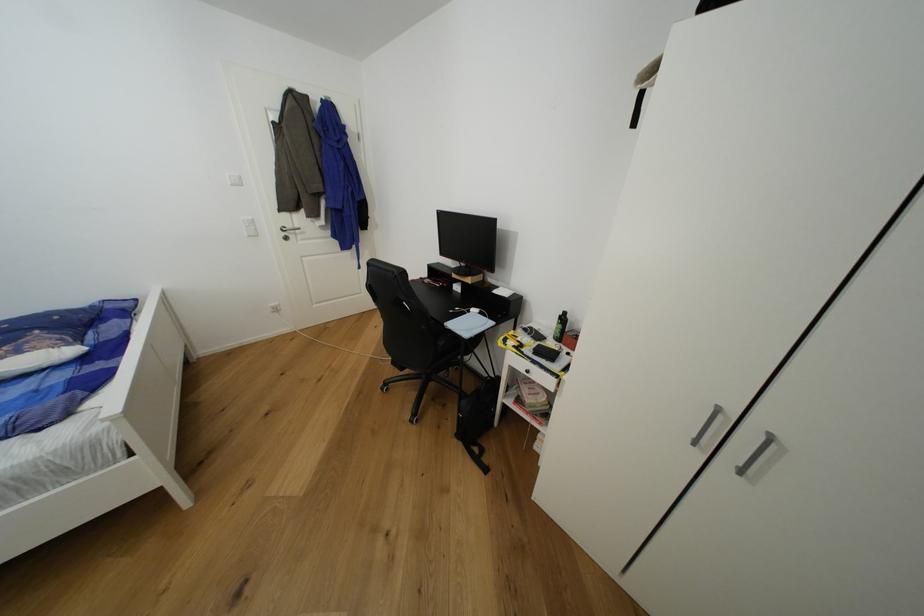
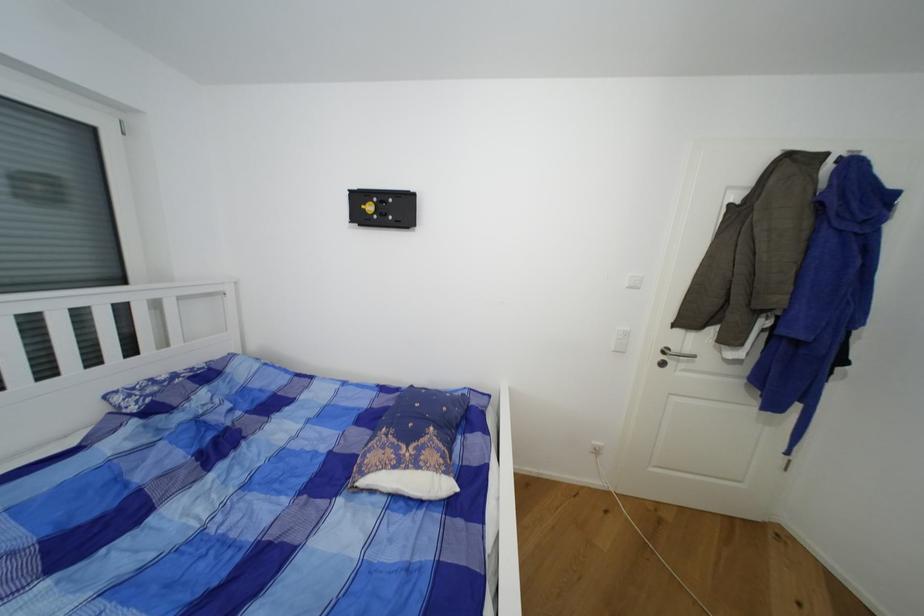
The point at (x=301, y=228) is marked in the first image. Where is the corresponding point in the second image?

(691, 352)